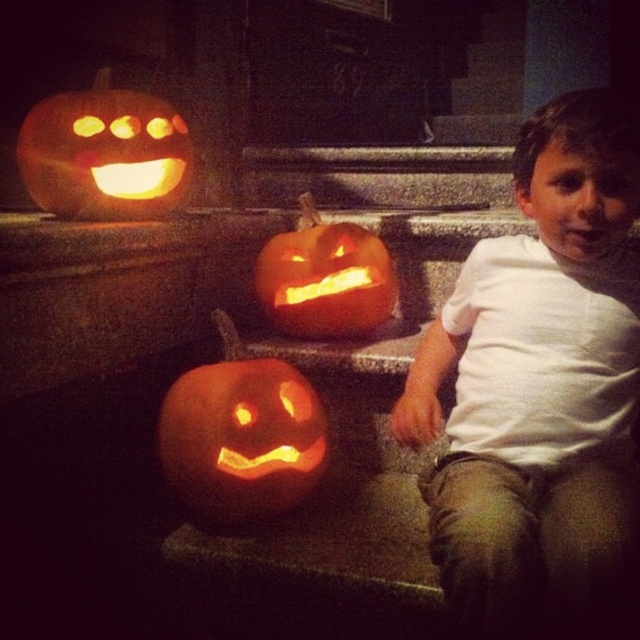
Based on the photo, measure the distance between white cotton shirt at center and orange matte pumpkin at center.

16.07 inches

Consider the image. Does white cotton shirt at center lie behind orange matte pumpkin at center?

No, white cotton shirt at center is in front of orange matte pumpkin at center.

Who is more forward, (557,428) or (384,323)?

Point (557,428)

At what (x,y) coordinates should I click in order to perform the action: click on white cotton shirt at center. Please return your answer as a coordinate pair (x, y). The image size is (640, 640). Looking at the image, I should click on (538, 384).

Is point (164, 401) farther from viewer compared to point (360, 243)?

No, (164, 401) is in front of (360, 243).

Is carved orange pumpkin at center wider than orange matte pumpkin at center?

No.

The height and width of the screenshot is (640, 640). Identify the location of carved orange pumpkin at center. (241, 438).

Looking at this image, can you confirm if white cotton shirt at center is shorter than carved orange pumpkin at center?

No, white cotton shirt at center is not shorter than carved orange pumpkin at center.

Can you confirm if white cotton shirt at center is taller than carved orange pumpkin at center?

Yes.

You are a GUI agent. You are given a task and a screenshot of the screen. Output one action in this format:
    pyautogui.click(x=<x>, y=<y>)
    Task: Click on the white cotton shirt at center
    
    Given the screenshot: What is the action you would take?
    pyautogui.click(x=538, y=384)